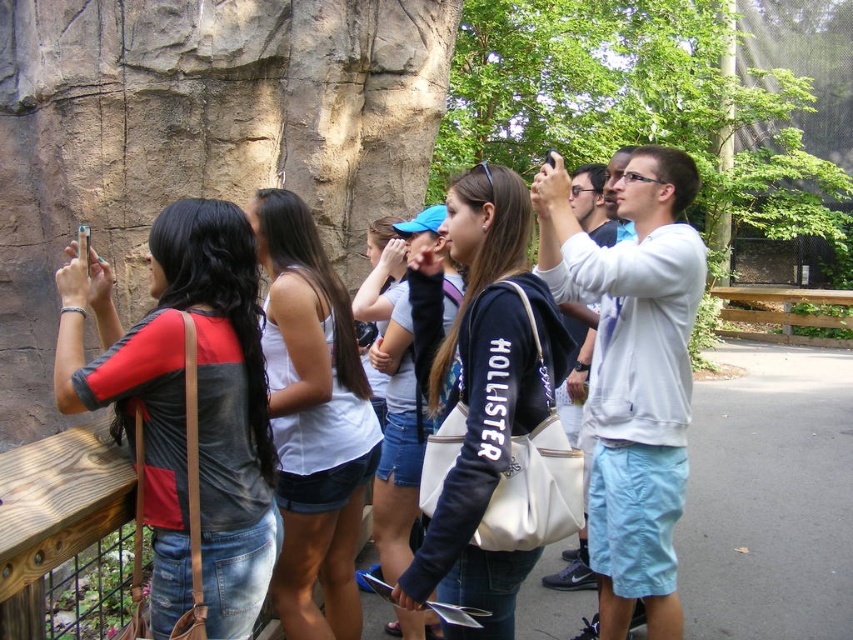
Question: Which point appears farthest from the camera in this image?

Choices:
 (A) click(683, 346)
 (B) click(254, 460)

Answer: (A)

Question: Which of the following is the farthest from the observer?

Choices:
 (A) matte black shirt at left
 (B) denim shorts at center
 (C) white cotton hoodie at upper right

Answer: (C)

Question: Is white cotton hoodie at upper right below denim shorts at center?

Choices:
 (A) yes
 (B) no

Answer: (A)

Question: Can you confirm if white matte tank top at center is positioned above denim shorts at center?

Choices:
 (A) no
 (B) yes

Answer: (A)

Question: Which object appears farthest from the camera in this image?

Choices:
 (A) denim shorts at center
 (B) matte black shirt at left

Answer: (A)

Question: Observing the image, what is the correct spatial positioning of white canvas bag at center in reference to denim shorts at center?

Choices:
 (A) below
 (B) above

Answer: (A)